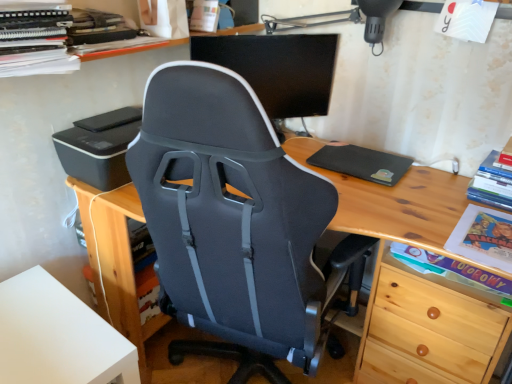
Question: Considering the relative sizes of orange spiral-bound book at upper left, positioned as the 3th book in right-to-left order, and wooden desk at center in the image provided, is orange spiral-bound book at upper left, positioned as the 3th book in right-to-left order, bigger than wooden desk at center?

Choices:
 (A) no
 (B) yes

Answer: (A)

Question: Can you confirm if orange spiral-bound book at upper left, the third book when ordered from bottom to top, is thinner than wooden desk at center?

Choices:
 (A) yes
 (B) no

Answer: (A)

Question: Is wooden desk at center inside orange spiral-bound book at upper left, the third book when ordered from bottom to top?

Choices:
 (A) no
 (B) yes

Answer: (A)

Question: From a real-world perspective, is orange spiral-bound book at upper left, which is the 1th book from left to right, physically below wooden desk at center?

Choices:
 (A) yes
 (B) no

Answer: (B)

Question: Does orange spiral-bound book at upper left, which is the 1th book from left to right, come in front of wooden desk at center?

Choices:
 (A) yes
 (B) no

Answer: (B)

Question: From the image's perspective, relative to black plastic printer at left, is white matte table at lower left above or below?

Choices:
 (A) above
 (B) below

Answer: (B)

Question: Looking at their shapes, would you say white matte table at lower left is wider or thinner than black plastic printer at left?

Choices:
 (A) wide
 (B) thin

Answer: (A)

Question: Is point (22, 362) positioned closer to the camera than point (84, 170)?

Choices:
 (A) farther
 (B) closer

Answer: (B)

Question: From a real-world perspective, is white matte table at lower left above or below black plastic printer at left?

Choices:
 (A) below
 (B) above

Answer: (A)

Question: Is point (437, 261) closer or farther from the camera than point (397, 165)?

Choices:
 (A) farther
 (B) closer

Answer: (B)

Question: In terms of size, does matte cardboard book at lower right, the second book in the right-to-left sequence, appear bigger or smaller than black matte/black rubberized mousepad at right?

Choices:
 (A) big
 (B) small

Answer: (B)

Question: Based on their positions, is matte cardboard book at lower right, the second book in the right-to-left sequence, located to the left or right of black matte/black rubberized mousepad at right?

Choices:
 (A) left
 (B) right

Answer: (B)

Question: From a real-world perspective, is matte cardboard book at lower right, placed as the 1th book when sorted from bottom to top, above or below black matte/black rubberized mousepad at right?

Choices:
 (A) above
 (B) below

Answer: (B)

Question: Is matte cardboard book at lower right, which is the 3th book from top to bottom, in front of or behind white matte table at lower left in the image?

Choices:
 (A) behind
 (B) front

Answer: (A)

Question: From a real-world perspective, is matte cardboard book at lower right, placed as the 1th book when sorted from bottom to top, above or below white matte table at lower left?

Choices:
 (A) above
 (B) below

Answer: (A)